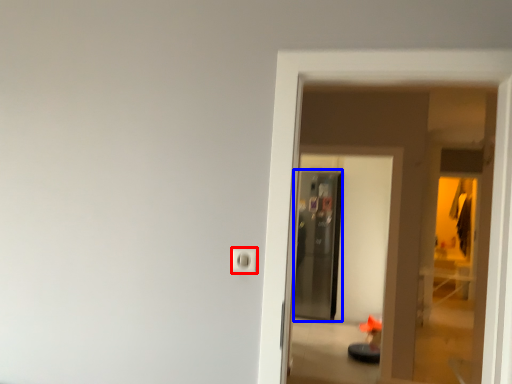
Question: Which object appears farthest to the camera in this image, electric outlet (highlighted by a red box) or screen door (highlighted by a blue box)?

Choices:
 (A) electric outlet
 (B) screen door

Answer: (B)